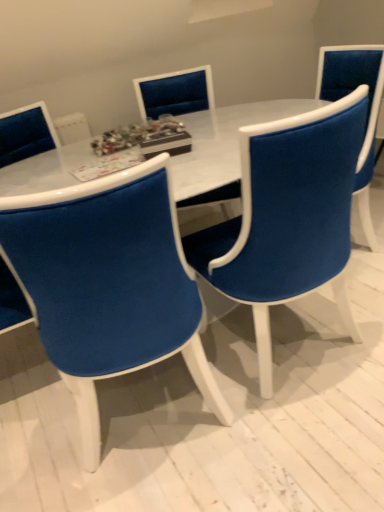
Question: Is velvet blue chair at center, arranged as the third chair when viewed from the front, far from velvet blue chair at center, the 2th chair positioned from the front?

Choices:
 (A) yes
 (B) no

Answer: (A)

Question: Considering the relative sizes of velvet blue chair at center, arranged as the third chair when viewed from the front, and velvet blue chair at center, the 2th chair positioned from the front, in the image provided, is velvet blue chair at center, arranged as the third chair when viewed from the front, smaller than velvet blue chair at center, the 2th chair positioned from the front,?

Choices:
 (A) no
 (B) yes

Answer: (B)

Question: Does velvet blue chair at center, arranged as the third chair when viewed from the front, appear on the right side of velvet blue chair at center, placed as the 2th chair when sorted from back to front?

Choices:
 (A) no
 (B) yes

Answer: (A)

Question: Is velvet blue chair at center, arranged as the third chair when viewed from the front, next to velvet blue chair at center, the 2th chair positioned from the front, and touching it?

Choices:
 (A) no
 (B) yes

Answer: (A)

Question: Is velvet blue chair at center, the 1th chair in the back-to-front sequence, closer to the viewer compared to velvet blue chair at center, the 2th chair positioned from the front?

Choices:
 (A) no
 (B) yes

Answer: (A)

Question: From a real-world perspective, is velvet blue chair at center, arranged as the third chair when viewed from the front, positioned over velvet blue chair at center, placed as the 2th chair when sorted from back to front, based on gravity?

Choices:
 (A) no
 (B) yes

Answer: (B)

Question: Is velvet blue chair at center, the 2th chair positioned from the front, oriented away from velvet blue chair at center, arranged as the first chair when viewed from the front?

Choices:
 (A) no
 (B) yes

Answer: (A)

Question: Is velvet blue chair at center, arranged as the first chair when viewed from the front, a part of velvet blue chair at center, the 2th chair positioned from the front?

Choices:
 (A) yes
 (B) no

Answer: (B)

Question: Is velvet blue chair at center, the 2th chair positioned from the front, located outside velvet blue chair at center, the third chair positioned from the back?

Choices:
 (A) no
 (B) yes

Answer: (B)

Question: Is velvet blue chair at center, placed as the 2th chair when sorted from back to front, smaller than velvet blue chair at center, the third chair positioned from the back?

Choices:
 (A) yes
 (B) no

Answer: (B)

Question: Considering the relative sizes of velvet blue chair at center, placed as the 2th chair when sorted from back to front, and velvet blue chair at center, the third chair positioned from the back, in the image provided, is velvet blue chair at center, placed as the 2th chair when sorted from back to front, wider than velvet blue chair at center, the third chair positioned from the back,?

Choices:
 (A) no
 (B) yes

Answer: (B)

Question: Considering the relative positions of velvet blue chair at center, the 2th chair positioned from the front, and velvet blue chair at center, arranged as the first chair when viewed from the front, in the image provided, is velvet blue chair at center, the 2th chair positioned from the front, to the right of velvet blue chair at center, arranged as the first chair when viewed from the front, from the viewer's perspective?

Choices:
 (A) no
 (B) yes

Answer: (B)

Question: Is white marble table at center closer to the viewer compared to velvet blue chair at center, arranged as the first chair when viewed from the front?

Choices:
 (A) no
 (B) yes

Answer: (A)